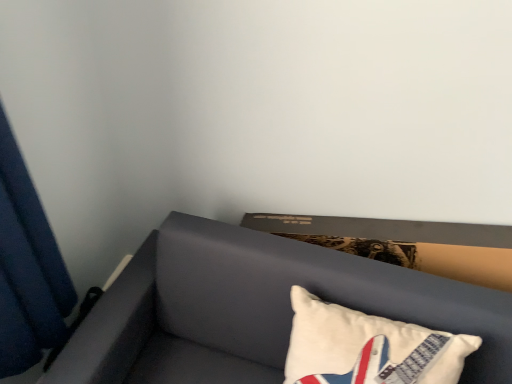
Question: From a real-world perspective, is white cotton pillow at lower right above or below suede-like gray sofa at lower right?

Choices:
 (A) above
 (B) below

Answer: (A)

Question: Is white cotton pillow at lower right situated inside suede-like gray sofa at lower right or outside?

Choices:
 (A) outside
 (B) inside

Answer: (B)

Question: Which is nearer to the suede-like gray sofa at lower right?

Choices:
 (A) blue fabric curtain at left
 (B) white cotton pillow at lower right

Answer: (B)

Question: Which is farther from the blue fabric curtain at left?

Choices:
 (A) white cotton pillow at lower right
 (B) suede-like gray sofa at lower right

Answer: (A)